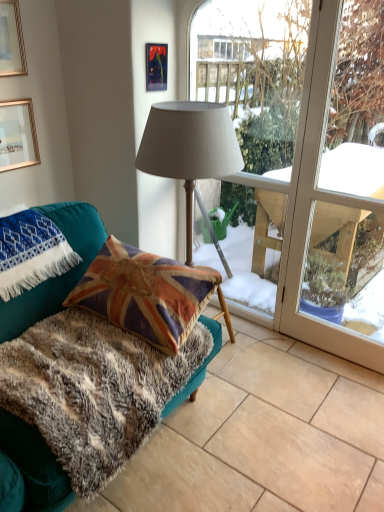
Question: From the image's perspective, does teal fabric couch at lower left appear higher than fuzzy fabric rug at lower left?

Choices:
 (A) no
 (B) yes

Answer: (B)

Question: Considering the relative sizes of teal fabric couch at lower left and fuzzy fabric rug at lower left in the image provided, is teal fabric couch at lower left taller than fuzzy fabric rug at lower left?

Choices:
 (A) no
 (B) yes

Answer: (B)

Question: Can you confirm if teal fabric couch at lower left is positioned to the left of fuzzy fabric rug at lower left?

Choices:
 (A) yes
 (B) no

Answer: (A)

Question: Is teal fabric couch at lower left smaller than fuzzy fabric rug at lower left?

Choices:
 (A) yes
 (B) no

Answer: (B)

Question: Is teal fabric couch at lower left to the right of fuzzy fabric rug at lower left from the viewer's perspective?

Choices:
 (A) no
 (B) yes

Answer: (A)

Question: From a real-world perspective, is gold-framed picture at upper left, the third picture frame viewed from the right, physically located above or below matte plastic picture frame at upper center, which is counted as the 3th picture frame, starting from the left?

Choices:
 (A) above
 (B) below

Answer: (B)

Question: Considering the relative positions of gold-framed picture at upper left, the third picture frame viewed from the right, and matte plastic picture frame at upper center, which is counted as the 3th picture frame, starting from the left, in the image provided, is gold-framed picture at upper left, the third picture frame viewed from the right, to the left or to the right of matte plastic picture frame at upper center, which is counted as the 3th picture frame, starting from the left,?

Choices:
 (A) left
 (B) right

Answer: (A)

Question: Is gold-framed picture at upper left, marked as the 1th picture frame in a left-to-right arrangement, in front of or behind matte plastic picture frame at upper center, which is counted as the 3th picture frame, starting from the left, in the image?

Choices:
 (A) behind
 (B) front

Answer: (B)

Question: Is gold-framed picture at upper left, the third picture frame viewed from the right, inside or outside of matte plastic picture frame at upper center, which is counted as the 3th picture frame, starting from the left?

Choices:
 (A) inside
 (B) outside

Answer: (B)

Question: From a real-world perspective, is transparent glass window at center above or below gold-framed picture at upper left, the third picture frame viewed from the right?

Choices:
 (A) below
 (B) above

Answer: (A)

Question: From the image's perspective, relative to gold-framed picture at upper left, marked as the 1th picture frame in a left-to-right arrangement, is transparent glass window at center above or below?

Choices:
 (A) below
 (B) above

Answer: (A)

Question: Would you say transparent glass window at center is to the left or to the right of gold-framed picture at upper left, marked as the 1th picture frame in a left-to-right arrangement, in the picture?

Choices:
 (A) left
 (B) right

Answer: (B)

Question: In terms of width, does transparent glass window at center look wider or thinner when compared to gold-framed picture at upper left, marked as the 1th picture frame in a left-to-right arrangement?

Choices:
 (A) wide
 (B) thin

Answer: (A)

Question: In terms of size, does teal fabric couch at lower left appear bigger or smaller than matte fabric lamp at center?

Choices:
 (A) big
 (B) small

Answer: (A)

Question: Is point (6, 439) positioned closer to the camera than point (157, 129)?

Choices:
 (A) farther
 (B) closer

Answer: (B)